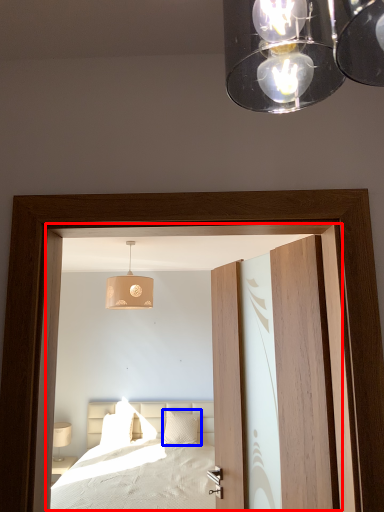
Question: Among these objects, which one is farthest to the camera, window (highlighted by a red box) or pillow (highlighted by a blue box)?

Choices:
 (A) window
 (B) pillow

Answer: (B)